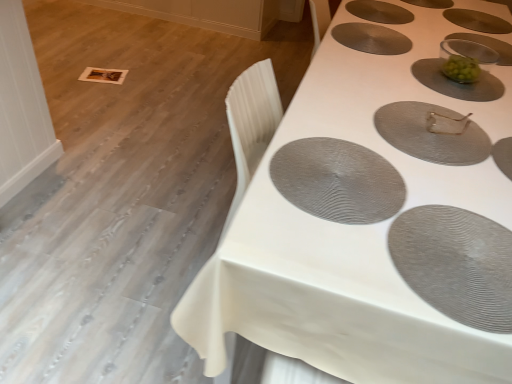
Locate an element on the screen. vacant region below matte gray placemat at center, which is the fifth oval in back-to-front order (from a real-world perspective) is located at coordinates coord(428,130).